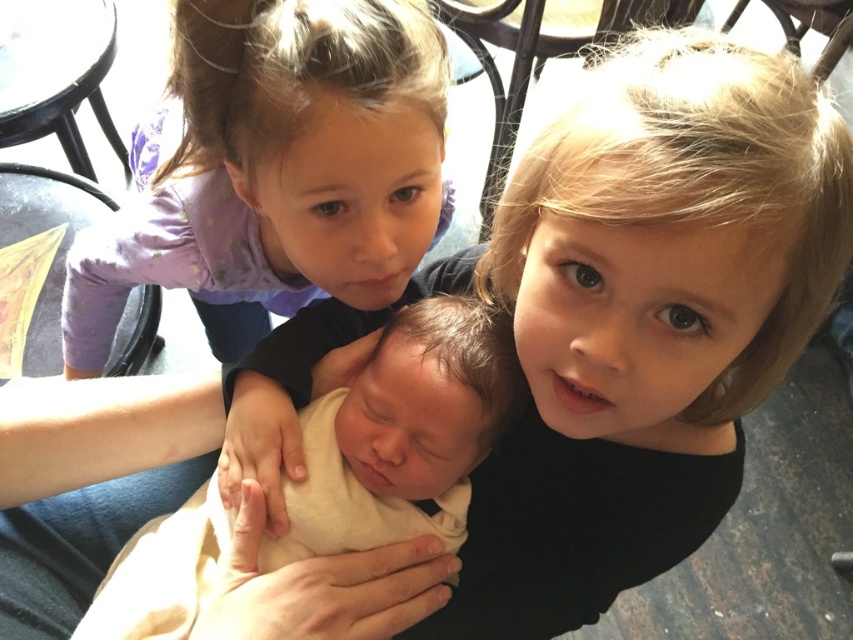
Does purple fabric at upper left appear on the right side of soft cream fabric newborn at center?

In fact, purple fabric at upper left is to the left of soft cream fabric newborn at center.

Which is above, purple fabric at upper left or soft cream fabric newborn at center?

purple fabric at upper left is higher up.

Is point (328, 20) farther from viewer compared to point (300, 410)?

No.

Find the location of a particular element. This screenshot has width=853, height=640. purple fabric at upper left is located at coordinates (277, 172).